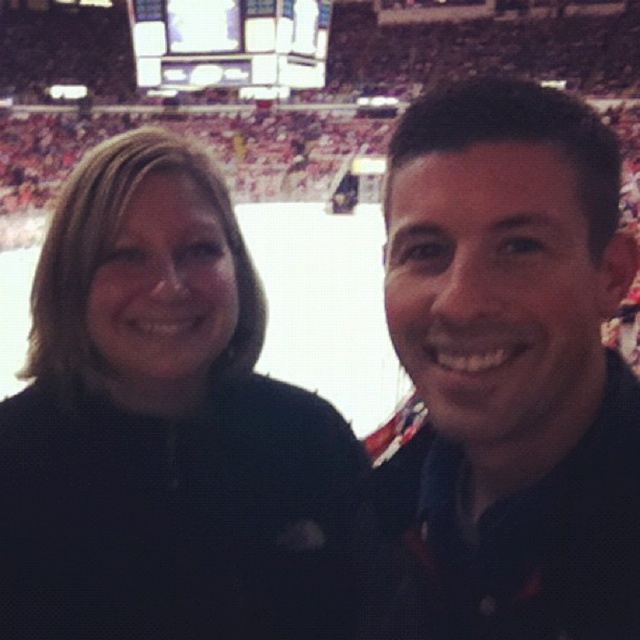
You are a photographer trying to capture a candid shot of both the black fleece jacket at left and the matte black shirt at right. Since both are dark in color, you need to adjust your camera settings to ensure proper exposure. Which object should you focus on first to avoid overexposing the darker areas?

The black fleece jacket at left is not as tall as matte black shirt at right, so focusing on the matte black shirt at right first would help avoid overexposure since it is taller and might require more attention in the frame.